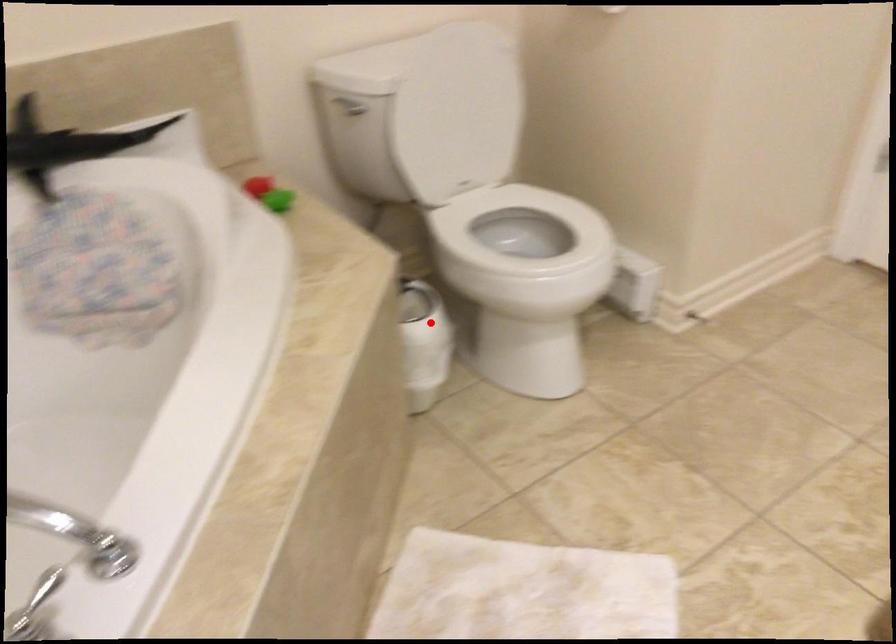
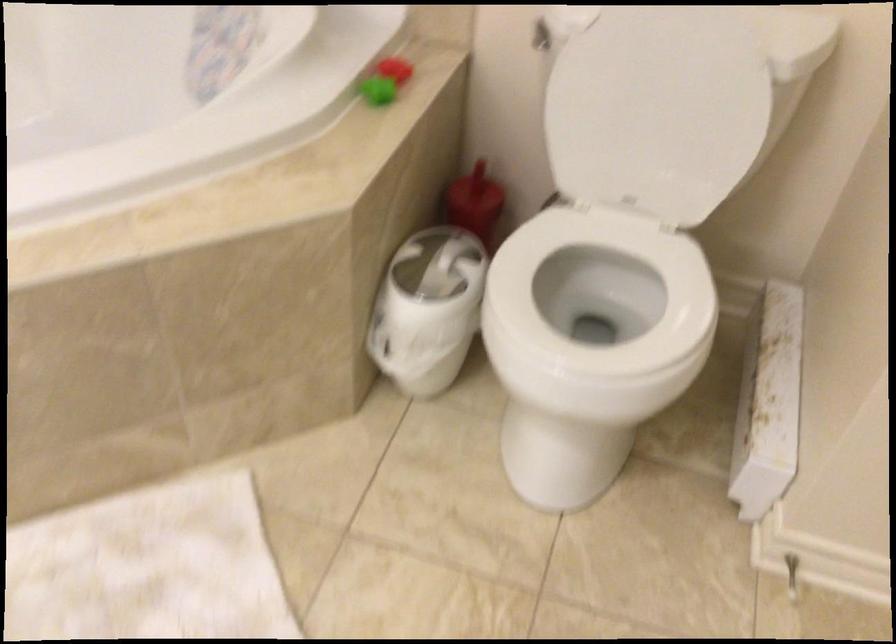
The point at the highlighted location is marked in the first image. Where is the corresponding point in the second image?

(427, 308)